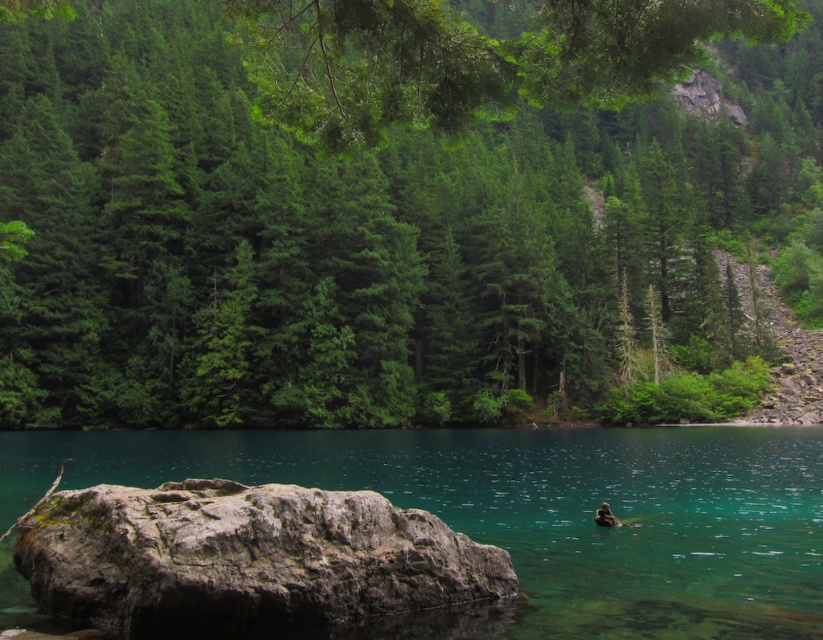
Question: Which point is closer to the camera?

Choices:
 (A) (419, 522)
 (B) (554, 529)

Answer: (A)

Question: Which point is closer to the camera?

Choices:
 (A) pyautogui.click(x=201, y=568)
 (B) pyautogui.click(x=714, y=1)
 (C) pyautogui.click(x=514, y=618)

Answer: (B)

Question: Considering the relative positions of green matte tree at center and gray rough rock at lower left in the image provided, where is green matte tree at center located with respect to gray rough rock at lower left?

Choices:
 (A) right
 (B) left

Answer: (A)

Question: Which object is the closest to the clear glassy water at center?

Choices:
 (A) gray rough rock at lower left
 (B) green matte tree at center

Answer: (A)

Question: Does green matte tree at center lie behind gray rough rock at lower left?

Choices:
 (A) no
 (B) yes

Answer: (A)

Question: Can you confirm if clear glassy water at center is positioned below gray rough rock at lower left?

Choices:
 (A) no
 (B) yes

Answer: (B)